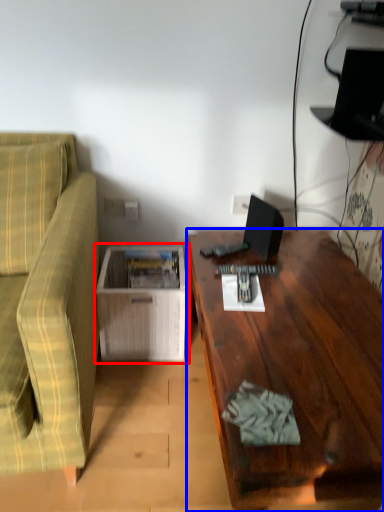
Question: Which of the following is the closest to the observer, table (highlighted by a red box) or desk (highlighted by a blue box)?

Choices:
 (A) table
 (B) desk

Answer: (B)